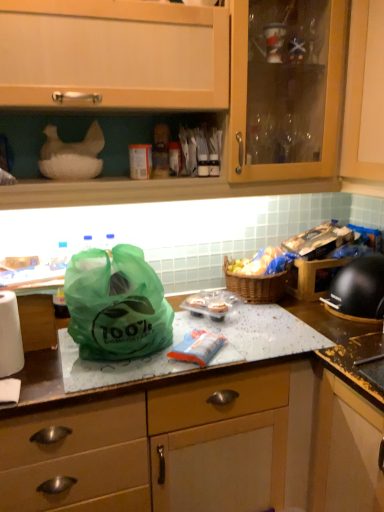
What is the approximate width of black plastic helmet at right?

It is 11.19 inches.

The width and height of the screenshot is (384, 512). Identify the location of transparent glass countertop at center. (188, 442).

In order to click on woven brown picnic basket at center in this screenshot , I will do `click(256, 284)`.

In order to face brown woven basket at upper right, should I rotate leftwards or rightwards?

A 9.018 degree turn to the right will do.

What is the approximate height of green plastic bag at center?

The height of green plastic bag at center is 32.08 centimeters.

This screenshot has height=512, width=384. Describe the element at coordinates (117, 53) in the screenshot. I see `wooden cabinet at upper center` at that location.

Find the location of a particular element. This screenshot has width=384, height=512. black plastic helmet at right is located at coordinates (358, 290).

In the scene shown: Who is more distant, wooden cabinet at upper center or brown woven basket at upper right?

brown woven basket at upper right is behind.

From the image's perspective, is wooden cabinet at upper center above or below brown woven basket at upper right?

Based on their image positions, wooden cabinet at upper center is located above brown woven basket at upper right.

Is wooden cabinet at upper center to the left of brown woven basket at upper right from the viewer's perspective?

Indeed, wooden cabinet at upper center is positioned on the left side of brown woven basket at upper right.

In terms of height, does wooden cabinet at upper center look taller or shorter compared to woven brown picnic basket at center?

In the image, wooden cabinet at upper center appears to be taller than woven brown picnic basket at center.

Would you consider wooden cabinet at upper center to be distant from woven brown picnic basket at center?

No, wooden cabinet at upper center is not far away from woven brown picnic basket at center.

Looking at this image, from a real-world perspective, does wooden cabinet at upper center stand above woven brown picnic basket at center?

Yes.

Visually, is wooden cabinet at upper center positioned to the left or to the right of woven brown picnic basket at center?

Based on their positions, wooden cabinet at upper center is located to the left of woven brown picnic basket at center.

Which object is wider, brown woven basket at upper right or wooden cabinet at upper center?

wooden cabinet at upper center.

The height and width of the screenshot is (512, 384). What are the coordinates of `cabinetry that is in front of the brown woven basket at upper right` in the screenshot? It's located at (117, 53).

From a real-world perspective, is brown woven basket at upper right positioned above or below wooden cabinet at upper center?

In terms of real-world spatial position, brown woven basket at upper right is below wooden cabinet at upper center.

From the picture: How far apart are brown woven basket at upper right and wooden cabinet at upper center?

They are 25.46 inches apart.

Considering the relative positions of wooden cabinet at upper center and transparent glass countertop at center in the image provided, is wooden cabinet at upper center to the left of transparent glass countertop at center from the viewer's perspective?

Yes, wooden cabinet at upper center is to the left of transparent glass countertop at center.

At what (x,y) coordinates should I click in order to perform the action: click on countertop lying below the wooden cabinet at upper center (from the image's perspective). Please return your answer as a coordinate pair (x, y). Looking at the image, I should click on (188, 442).

Is wooden cabinet at upper center not within transparent glass countertop at center?

Absolutely, wooden cabinet at upper center is external to transparent glass countertop at center.

Is wooden cabinet at upper center closer to camera compared to transparent glass countertop at center?

Yes.

Are green plastic bag at center and woven brown picnic basket at center located far from each other?

No, there isn't a large distance between green plastic bag at center and woven brown picnic basket at center.

Is green plastic bag at center facing towards woven brown picnic basket at center?

No, green plastic bag at center is not oriented towards woven brown picnic basket at center.

Which is less distant, (159, 340) or (239, 287)?

The point (159, 340) is closer to the camera.

Does green plastic bag at center contain woven brown picnic basket at center?

That's incorrect, woven brown picnic basket at center is not inside green plastic bag at center.

Is transparent glass countertop at center taller or shorter than black plastic helmet at right?

Considering their sizes, transparent glass countertop at center has more height than black plastic helmet at right.

Does transparent glass countertop at center have a lesser width compared to black plastic helmet at right?

No, transparent glass countertop at center is not thinner than black plastic helmet at right.

Identify the location of kitchen appliance that appears behind the transparent glass countertop at center. The height and width of the screenshot is (512, 384). (358, 290).

Based on the photo, is transparent glass countertop at center not close to black plastic helmet at right?

No.

Measure the distance between transparent glass countertop at center and white paper towel at left.

transparent glass countertop at center is 21.33 inches away from white paper towel at left.

Is transparent glass countertop at center facing towards white paper towel at left?

No, transparent glass countertop at center is not facing towards white paper towel at left.

Considering the sizes of transparent glass countertop at center and white paper towel at left in the image, is transparent glass countertop at center bigger or smaller than white paper towel at left?

Considering their sizes, transparent glass countertop at center takes up more space than white paper towel at left.

Which is more to the left, transparent glass countertop at center or white paper towel at left?

white paper towel at left.

Find the location of a particular element. cabinetry above the brown woven basket at upper right (from the image's perspective) is located at coordinates (117, 53).

Locate an element on the screen. The height and width of the screenshot is (512, 384). cabinetry that is in front of the woven brown picnic basket at center is located at coordinates (117, 53).

Considering their positions, is white paper towel at left positioned further to green plastic bag at center than transparent glass countertop at center?

The object further to green plastic bag at center is transparent glass countertop at center.

Considering their positions, is wooden cabinet at upper center positioned closer to brown woven basket at upper right than white paper towel at left?

The object closer to brown woven basket at upper right is wooden cabinet at upper center.

From the image, which object appears to be nearer to woven brown picnic basket at center, green plastic bag at center or white paper towel at left?

The object closer to woven brown picnic basket at center is green plastic bag at center.

Which object lies further to the anchor point green plastic bag at center, transparent glass countertop at center or white paper towel at left?

transparent glass countertop at center lies further to green plastic bag at center than the other object.

Which object lies further to the anchor point green plastic bag at center, brown woven basket at upper right or wooden cabinet at upper center?

Based on the image, brown woven basket at upper right appears to be further to green plastic bag at center.

Based on the photo, based on their spatial positions, is brown woven basket at upper right or black plastic helmet at right closer to green plastic bag at center?

Based on the image, brown woven basket at upper right appears to be nearer to green plastic bag at center.

Looking at the image, which one is located closer to green plastic bag at center, transparent glass countertop at center or wooden cabinet at upper center?

transparent glass countertop at center is closer to green plastic bag at center.

From the image, which object appears to be nearer to wooden cabinet at upper center, white paper towel at left or green plastic bag at center?

The object closer to wooden cabinet at upper center is green plastic bag at center.

Locate an element on the screen. paper towel between wooden cabinet at upper center and transparent glass countertop at center in the up-down direction is located at coordinates (10, 336).

You are a GUI agent. You are given a task and a screenshot of the screen. Output one action in this format:
    pyautogui.click(x=<x>, y=<y>)
    Task: Click on the kitchen appliance between wooden cabinet at upper center and transparent glass countertop at center in the up-down direction
    
    Given the screenshot: What is the action you would take?
    pyautogui.click(x=358, y=290)

Locate an element on the screen. This screenshot has width=384, height=512. food between white paper towel at left and black plastic helmet at right is located at coordinates (261, 262).

Where is `picnic basket between brown woven basket at upper right and transparent glass countertop at center vertically`? Image resolution: width=384 pixels, height=512 pixels. picnic basket between brown woven basket at upper right and transparent glass countertop at center vertically is located at coordinates (256, 284).